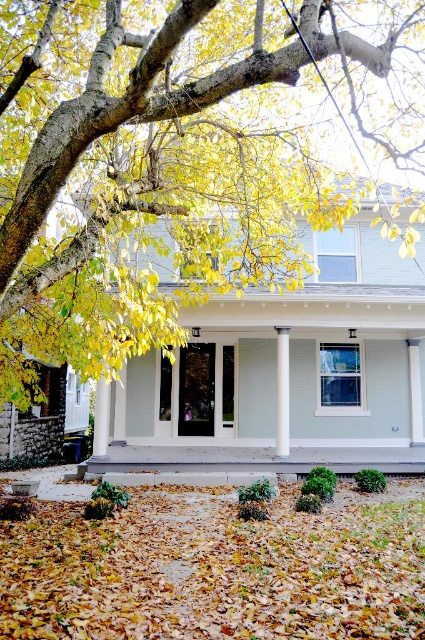
Who is taller, yellow leafy tree at upper left or light gray concrete porch at center?

light gray concrete porch at center

Does point (337, 65) come farther from viewer compared to point (129, 376)?

No, it is in front of (129, 376).

Who is more distant from viewer, (78, 125) or (418, 308)?

Positioned behind is point (418, 308).

Locate an element on the screen. yellow leafy tree at upper left is located at coordinates (167, 161).

Who is shorter, yellow leafy tree at upper left or brown leaf litter at lower center?

With less height is brown leaf litter at lower center.

Between point (115, 353) and point (115, 611), which one is positioned in front?

Point (115, 611) is in front.

Is point (56, 134) farther from camera compared to point (277, 497)?

That is False.

At what (x,y) coordinates should I click in order to perform the action: click on yellow leafy tree at upper left. Please return your answer as a coordinate pair (x, y). This screenshot has width=425, height=640. Looking at the image, I should click on (167, 161).

At what (x,y) coordinates should I click in order to perform the action: click on brown leaf litter at lower center. Please return your answer as a coordinate pair (x, y). Looking at the image, I should click on (218, 570).

Does brown leaf litter at lower center have a lesser height compared to white glossy column at center?

Yes.

Between point (153, 522) and point (283, 356), which one is positioned in front?

Positioned in front is point (153, 522).

Find the location of a particular element. brown leaf litter at lower center is located at coordinates (218, 570).